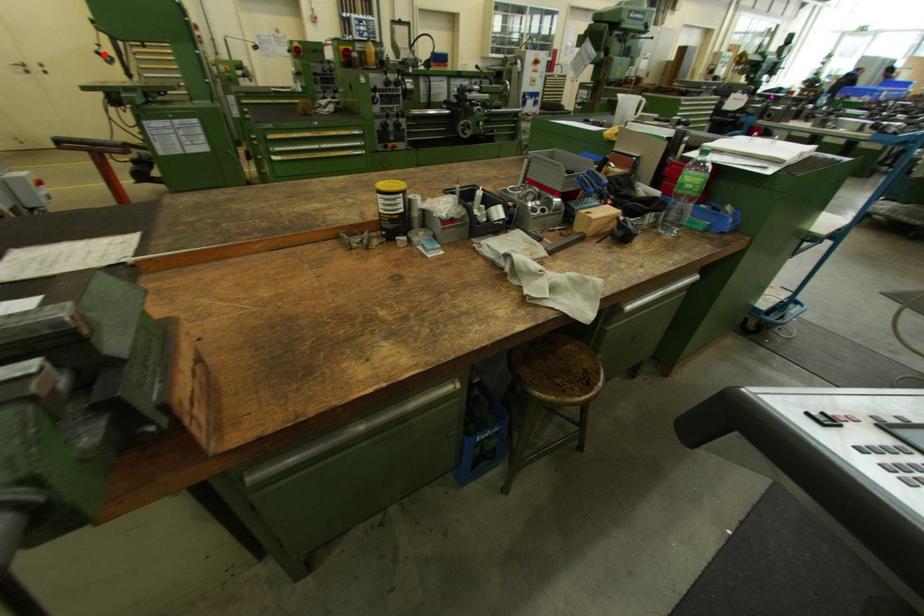
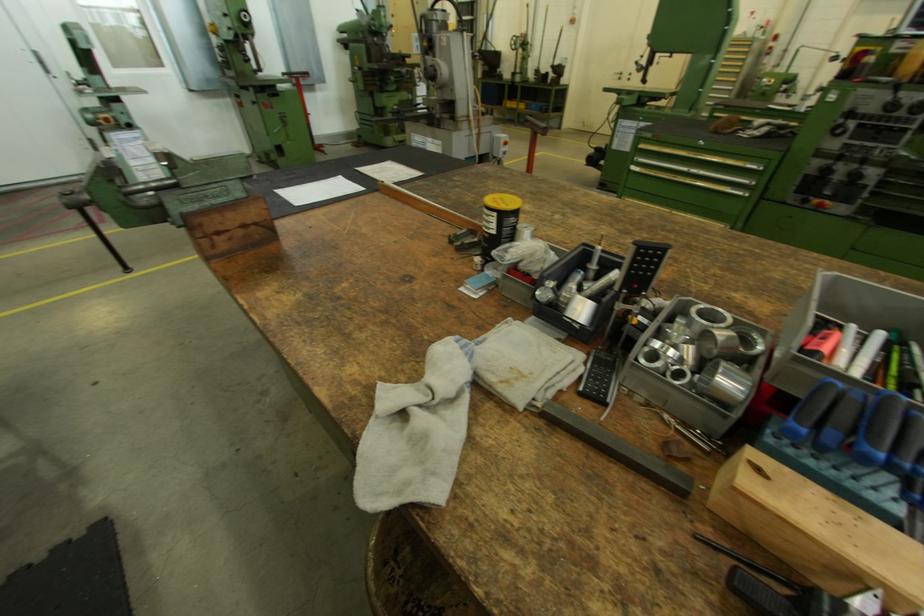
Find the pixel in the second image that matches the highlighted location in the first image.

(642, 63)